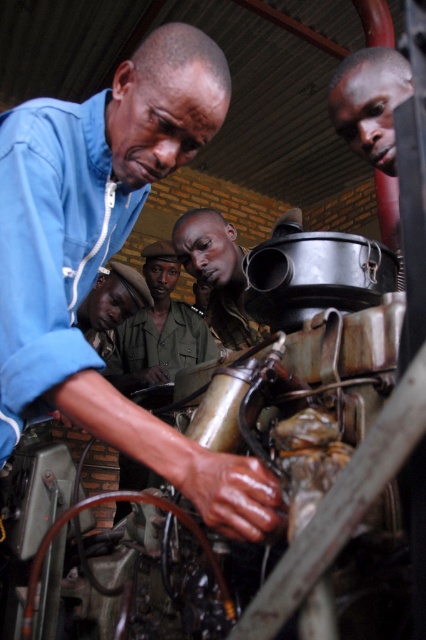
Who is positioned more to the left, blue matte shirt at upper left or metallic gray pipe at center?

blue matte shirt at upper left

Does blue matte shirt at upper left have a smaller size compared to metallic gray pipe at center?

Yes.

Which is in front, point (16, 134) or point (207, 262)?

Point (16, 134) is in front.

The image size is (426, 640). I want to click on blue matte shirt at upper left, so [106, 259].

Does blue matte shirt at upper left have a lesser width compared to smooth skin face at upper right?

No, blue matte shirt at upper left is not thinner than smooth skin face at upper right.

Is blue matte shirt at upper left smaller than smooth skin face at upper right?

No.

The image size is (426, 640). Identify the location of blue matte shirt at upper left. (106, 259).

Who is higher up, smooth skin face at upper right or metallic gray pipe at center?

Positioned higher is smooth skin face at upper right.

Is the position of smooth skin face at upper right less distant than that of metallic gray pipe at center?

Yes.

Identify the location of smooth skin face at upper right. The height and width of the screenshot is (640, 426). (370, 102).